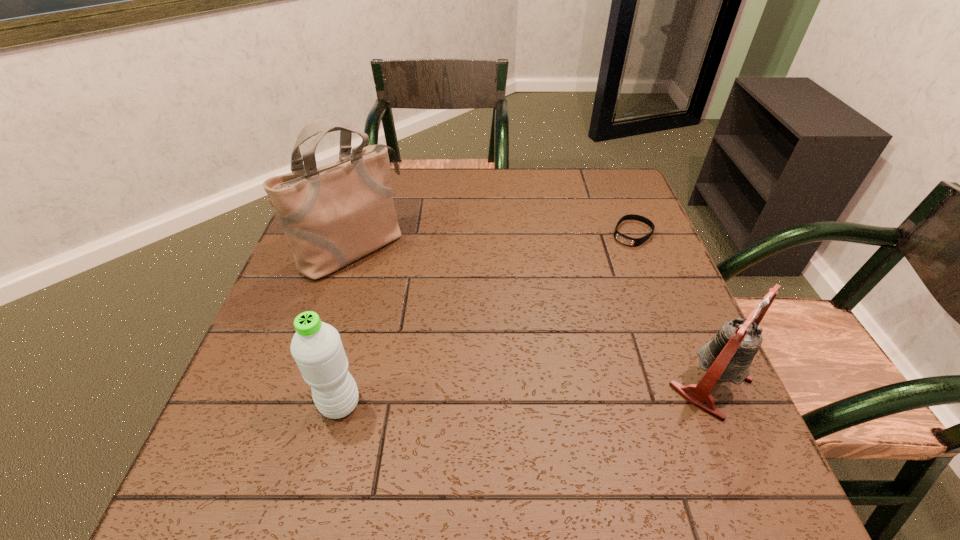
At what (x,y) coordinates should I click in order to perform the action: click on vacant spot on the desktop that is between the water bottle and the bell and is positioned on the display of the shortest object. Please return your answer as a coordinate pair (x, y). This screenshot has height=540, width=960. Looking at the image, I should click on (486, 396).

I want to click on vacant spot on the desktop that is between the water bottle and the bell and is positioned on the front-facing side of the shoulder bag, so click(x=524, y=394).